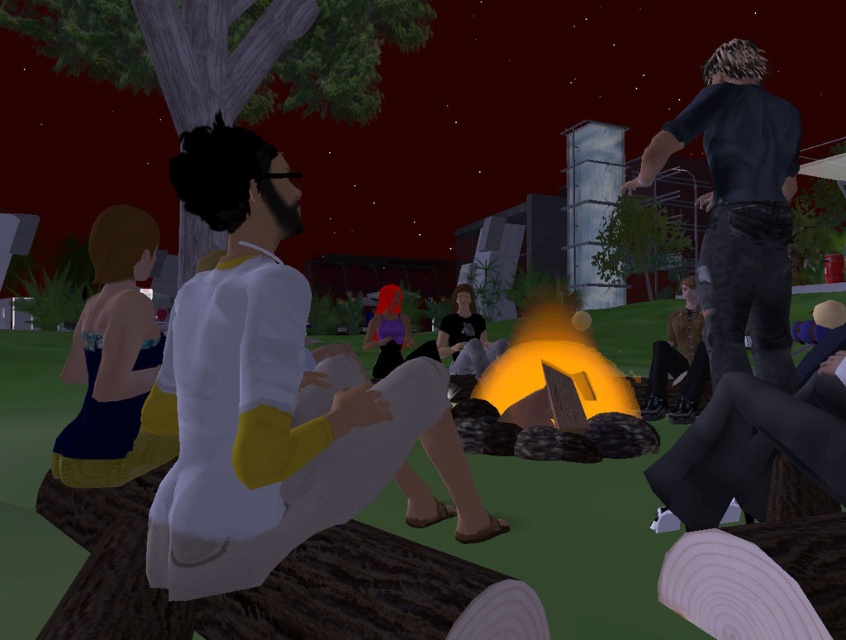
Does blue fabric dress at left lie behind matte black shirt at center?

No, it is in front of matte black shirt at center.

This screenshot has width=846, height=640. I want to click on blue fabric dress at left, so click(x=113, y=358).

Between point (127, 54) and point (106, 262), which one is positioned behind?

The point (127, 54) is behind.

How distant is smooth gray bark at upper left from blue fabric dress at left?

12.28 meters

Is point (11, 16) behind point (59, 435)?

That is True.

Find the location of a particular element. The width and height of the screenshot is (846, 640). smooth gray bark at upper left is located at coordinates (228, 51).

Between point (228, 6) and point (473, 310), which one is positioned in front?

Positioned in front is point (473, 310).

How much distance is there between smooth gray bark at upper left and matte black shirt at center?

The distance of smooth gray bark at upper left from matte black shirt at center is 31.39 feet.

Find the location of a particular element. The width and height of the screenshot is (846, 640). smooth gray bark at upper left is located at coordinates (228, 51).

Where is `smooth gray bark at upper left`? This screenshot has height=640, width=846. smooth gray bark at upper left is located at coordinates click(228, 51).